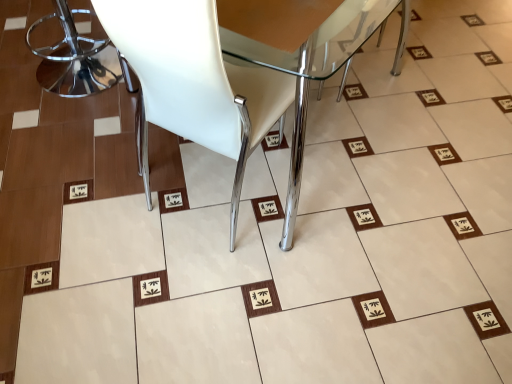
Question: Is white matte chair at center, which is the second chair in left-to-right order, to the left or to the right of polished chrome bar stool at left, the 2th chair positioned from the right, in the image?

Choices:
 (A) left
 (B) right

Answer: (B)

Question: From the image's perspective, is white matte chair at center, which appears as the first chair when viewed from the right, located above or below polished chrome bar stool at left, the 2th chair positioned from the right?

Choices:
 (A) above
 (B) below

Answer: (B)

Question: From a real-world perspective, is white matte chair at center, which is the second chair in left-to-right order, above or below polished chrome bar stool at left, the 2th chair positioned from the right?

Choices:
 (A) below
 (B) above

Answer: (B)

Question: From a real-world perspective, is polished chrome bar stool at left, the 2th chair positioned from the right, above or below white matte chair at center, which is the second chair in left-to-right order?

Choices:
 (A) above
 (B) below

Answer: (B)

Question: Is polished chrome bar stool at left, marked as the first chair in a left-to-right arrangement, wider or thinner than white matte chair at center, which is the second chair in left-to-right order?

Choices:
 (A) wide
 (B) thin

Answer: (B)

Question: From the image's perspective, is polished chrome bar stool at left, marked as the first chair in a left-to-right arrangement, above or below white matte chair at center, which appears as the first chair when viewed from the right?

Choices:
 (A) above
 (B) below

Answer: (A)

Question: Considering the relative positions of polished chrome bar stool at left, marked as the first chair in a left-to-right arrangement, and white matte chair at center, which appears as the first chair when viewed from the right, in the image provided, is polished chrome bar stool at left, marked as the first chair in a left-to-right arrangement, to the left or to the right of white matte chair at center, which appears as the first chair when viewed from the right,?

Choices:
 (A) right
 (B) left

Answer: (B)